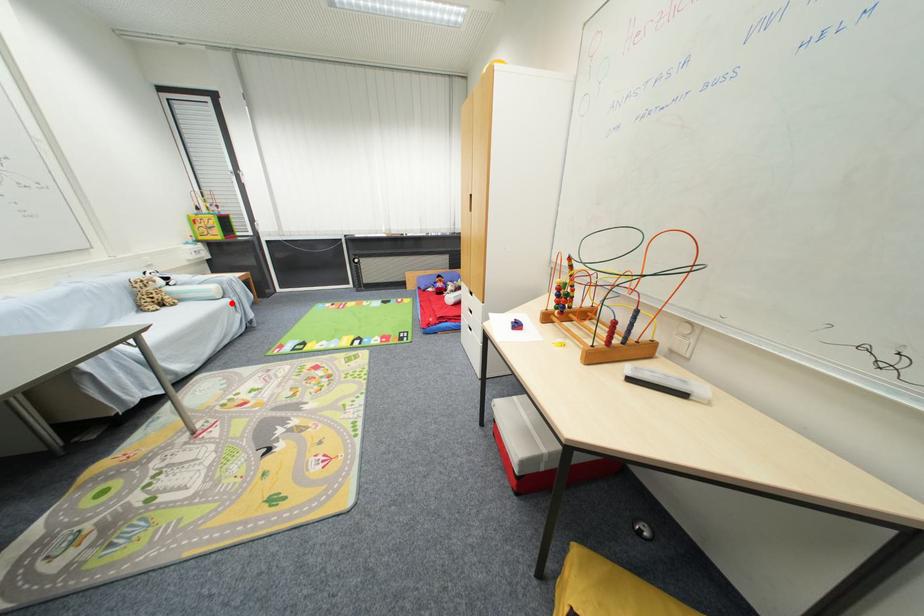
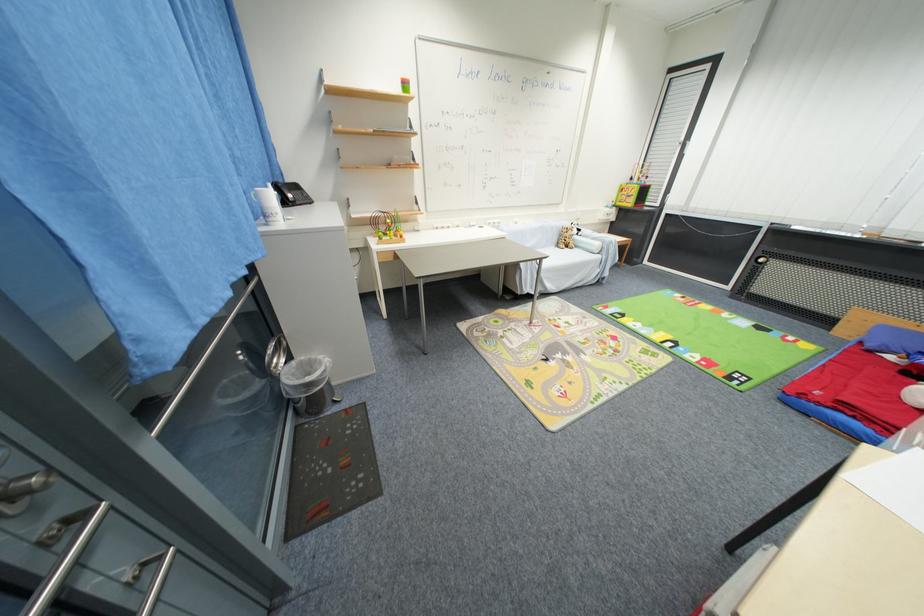
Find the pixel in the second image that matches the highlighted location in the first image.

(603, 259)